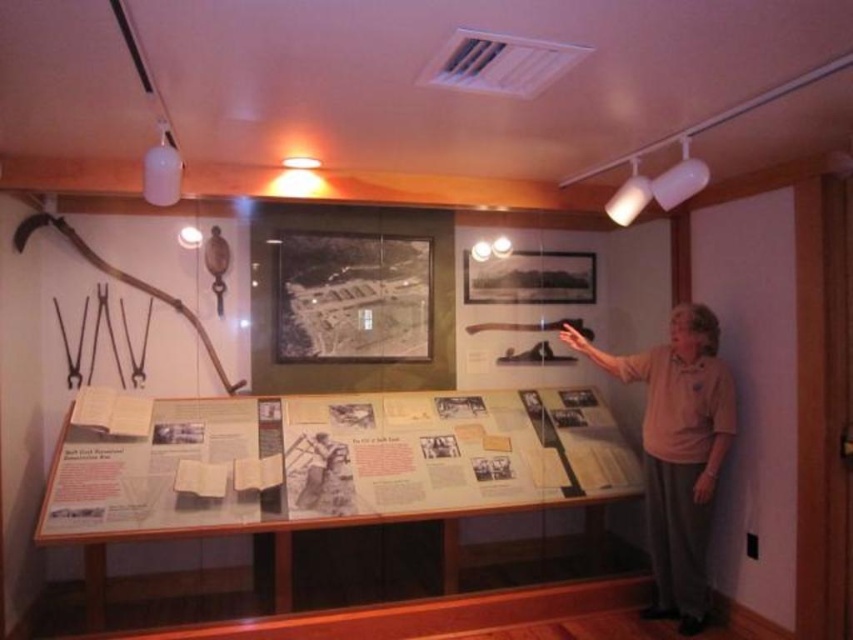
Can you confirm if pink cotton shirt at right is positioned below white paper at center?

Actually, pink cotton shirt at right is above white paper at center.

Can you confirm if pink cotton shirt at right is shorter than white paper at center?

In fact, pink cotton shirt at right may be taller than white paper at center.

Which is behind, point (672, 524) or point (328, 506)?

Positioned behind is point (672, 524).

Locate an element on the screen. Image resolution: width=853 pixels, height=640 pixels. pink cotton shirt at right is located at coordinates (677, 451).